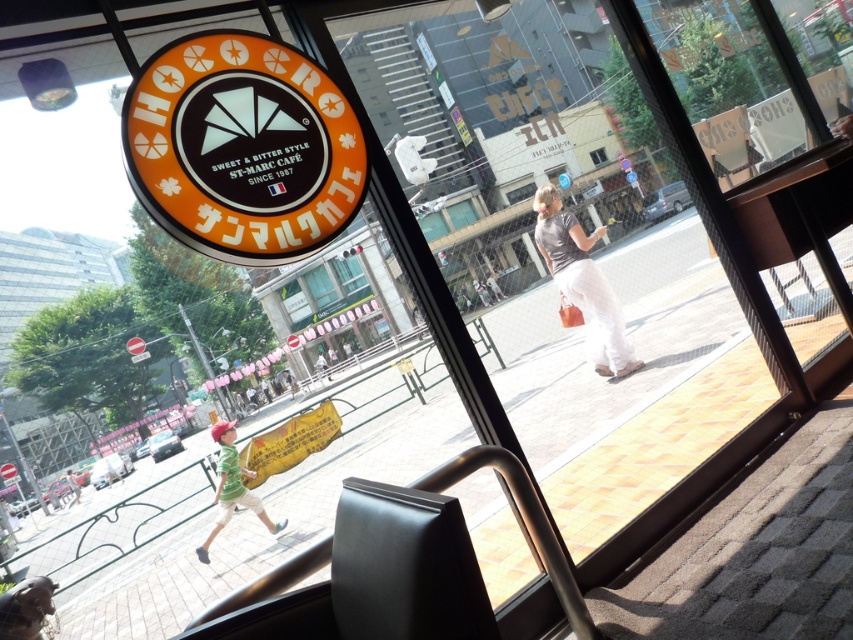
You are a customer at the St. Marc Cafe and notice two green shirts hanging on a rack near the entrance. The shirts are labeled as the green striped shirt at lower left and the green fabric shirt at lower left. Which shirt is taller?

The green striped shirt at lower left is taller than the green fabric shirt at lower left.

From the picture: You are a customer waiting at the green striped shirt at lower left and want to reach the green fabric umbrella at center. Which direction should you walk to get closer to the umbrella?

The green striped shirt at lower left is in front of the green fabric umbrella at center, so you should walk backward to move toward the umbrella.

You are standing inside the St. Marc Cafe and looking out the window. There are two points marked on the window. The first point is at coordinate (x=247, y=493) and the second point is at coordinate (x=70, y=500). Which point is closer to you?

Point (x=247, y=493) is in front of point (x=70, y=500), so it is closer to you.